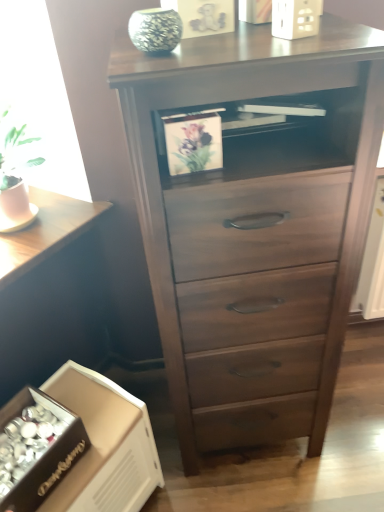
From the picture: What is the approximate height of dark wood table at lower left?

The height of dark wood table at lower left is 85.07 centimeters.

What is the approximate height of white cardboard box at lower left?

The height of white cardboard box at lower left is 20.02 inches.

This screenshot has height=512, width=384. What do you see at coordinates (255, 226) in the screenshot?
I see `dark wood chest of drawers at center` at bounding box center [255, 226].

This screenshot has height=512, width=384. I want to click on dark wood table at lower left, so 51,292.

From the image's perspective, would you say dark wood chest of drawers at center is shown under green textured vase at upper center?

Indeed, from the image's perspective, dark wood chest of drawers at center is shown beneath green textured vase at upper center.

Is dark wood chest of drawers at center completely or partially outside of green textured vase at upper center?

Yes, dark wood chest of drawers at center is outside of green textured vase at upper center.

Which is nearer, (197, 291) or (162, 33)?

Positioned in front is point (162, 33).

Looking at this image, from a real-world perspective, is dark wood chest of drawers at center located higher than green textured vase at upper center?

No, from a real-world perspective, dark wood chest of drawers at center is not above green textured vase at upper center.

Which of these two, green textured vase at upper center or white cardboard box at lower left, stands taller?

white cardboard box at lower left.

Relative to white cardboard box at lower left, is green textured vase at upper center in front or behind?

green textured vase at upper center is in front of white cardboard box at lower left.

Does green textured vase at upper center turn towards white cardboard box at lower left?

No, green textured vase at upper center is not oriented towards white cardboard box at lower left.

Considering the relative positions of green textured vase at upper center and white cardboard box at lower left in the image provided, is green textured vase at upper center to the left or to the right of white cardboard box at lower left?

In the image, green textured vase at upper center appears on the right side of white cardboard box at lower left.

Between green textured vase at upper center and dark wood table at lower left, which one has less height?

green textured vase at upper center is shorter.

Is green textured vase at upper center not close to dark wood table at lower left?

green textured vase at upper center is near dark wood table at lower left, not far away.

Is green textured vase at upper center turned away from dark wood table at lower left?

No.

What's the angular difference between dark wood table at lower left and dark wood chest of drawers at center's facing directions?

49.3 degrees.

Which of these two, dark wood table at lower left or dark wood chest of drawers at center, is wider?

With larger width is dark wood table at lower left.

Does dark wood table at lower left come in front of dark wood chest of drawers at center?

No, dark wood table at lower left is behind dark wood chest of drawers at center.

From the image's perspective, is dark wood table at lower left under dark wood chest of drawers at center?

Yes, from the image's perspective, dark wood table at lower left is beneath dark wood chest of drawers at center.

Locate an element on the screen. The height and width of the screenshot is (512, 384). the chest of drawers positioned vertically above the dark wood table at lower left (from a real-world perspective) is located at coordinates (255, 226).

How different are the orientations of dark wood chest of drawers at center and dark wood table at lower left in degrees?

dark wood chest of drawers at center and dark wood table at lower left are facing 49.3 degrees away from each other.

From the image's perspective, is dark wood chest of drawers at center over dark wood table at lower left?

Yes, from the image's perspective, dark wood chest of drawers at center is over dark wood table at lower left.

Is point (303, 127) closer to camera compared to point (85, 270)?

Yes, it is.

Is dark wood chest of drawers at center positioned with its back to white cardboard box at lower left?

No.

From the image's perspective, between dark wood chest of drawers at center and white cardboard box at lower left, who is located below?

white cardboard box at lower left appears lower in the image.

What's the angular difference between dark wood chest of drawers at center and white cardboard box at lower left's facing directions?

48.6 degrees separate the facing orientations of dark wood chest of drawers at center and white cardboard box at lower left.

Is dark wood chest of drawers at center to the right of white cardboard box at lower left from the viewer's perspective?

Yes.

Considering the sizes of objects green textured vase at upper center and dark wood chest of drawers at center in the image provided, who is thinner, green textured vase at upper center or dark wood chest of drawers at center?

green textured vase at upper center.

Is green textured vase at upper center facing away from dark wood chest of drawers at center?

No, green textured vase at upper center is not facing the opposite direction of dark wood chest of drawers at center.

Is green textured vase at upper center at the left side of dark wood chest of drawers at center?

Indeed, green textured vase at upper center is positioned on the left side of dark wood chest of drawers at center.

Is dark wood chest of drawers at center inside green textured vase at upper center?

No, dark wood chest of drawers at center is not surrounded by green textured vase at upper center.

The height and width of the screenshot is (512, 384). In order to click on the chest of drawers located underneath the green textured vase at upper center (from a real-world perspective) in this screenshot , I will do `click(255, 226)`.

Find the location of a particular element. The image size is (384, 512). cardboard box below the green textured vase at upper center (from the image's perspective) is located at coordinates (105, 445).

Based on their spatial positions, is dark wood table at lower left or white cardboard box at lower left further from green textured vase at upper center?

Among the two, white cardboard box at lower left is located further to green textured vase at upper center.

From the image, which object appears to be nearer to dark wood table at lower left, green textured vase at upper center or white cardboard box at lower left?

Based on the image, white cardboard box at lower left appears to be nearer to dark wood table at lower left.

When comparing their distances from green textured vase at upper center, does dark wood chest of drawers at center or dark wood table at lower left seem further?

dark wood table at lower left.

Which object lies nearer to the anchor point white cardboard box at lower left, dark wood chest of drawers at center or green textured vase at upper center?

The object closer to white cardboard box at lower left is dark wood chest of drawers at center.

In the scene shown: From the image, which object appears to be nearer to white cardboard box at lower left, dark wood table at lower left or green textured vase at upper center?

dark wood table at lower left is closer to white cardboard box at lower left.

Consider the image. Looking at the image, which one is located further to green textured vase at upper center, dark wood chest of drawers at center or white cardboard box at lower left?

white cardboard box at lower left lies further to green textured vase at upper center than the other object.

Considering their positions, is dark wood chest of drawers at center positioned closer to dark wood table at lower left than green textured vase at upper center?

dark wood chest of drawers at center is closer to dark wood table at lower left.

Looking at the image, which one is located further to dark wood table at lower left, green textured vase at upper center or dark wood chest of drawers at center?

green textured vase at upper center.

Image resolution: width=384 pixels, height=512 pixels. I want to click on cardboard box between dark wood table at lower left and dark wood chest of drawers at center in the horizontal direction, so click(105, 445).

Locate an element on the screen. Image resolution: width=384 pixels, height=512 pixels. glass vase between dark wood table at lower left and dark wood chest of drawers at center from left to right is located at coordinates (155, 30).

This screenshot has width=384, height=512. I want to click on table between green textured vase at upper center and white cardboard box at lower left from top to bottom, so click(x=51, y=292).

Find the location of `the chest of drawers that lies between green textured vase at upper center and white cardboard box at lower left from top to bottom`. the chest of drawers that lies between green textured vase at upper center and white cardboard box at lower left from top to bottom is located at coordinates [x=255, y=226].